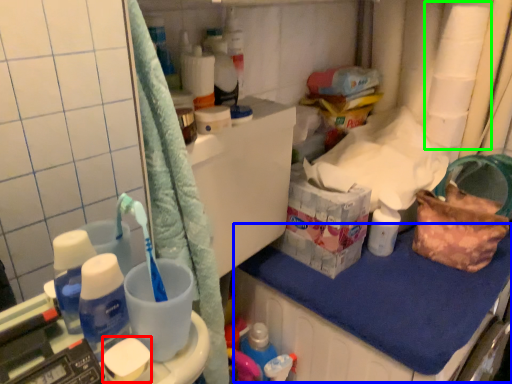
Question: Which is nearer to the soap (highlighted by a red box)? counter top (highlighted by a blue box) or toilet paper (highlighted by a green box).

Choices:
 (A) counter top
 (B) toilet paper

Answer: (A)